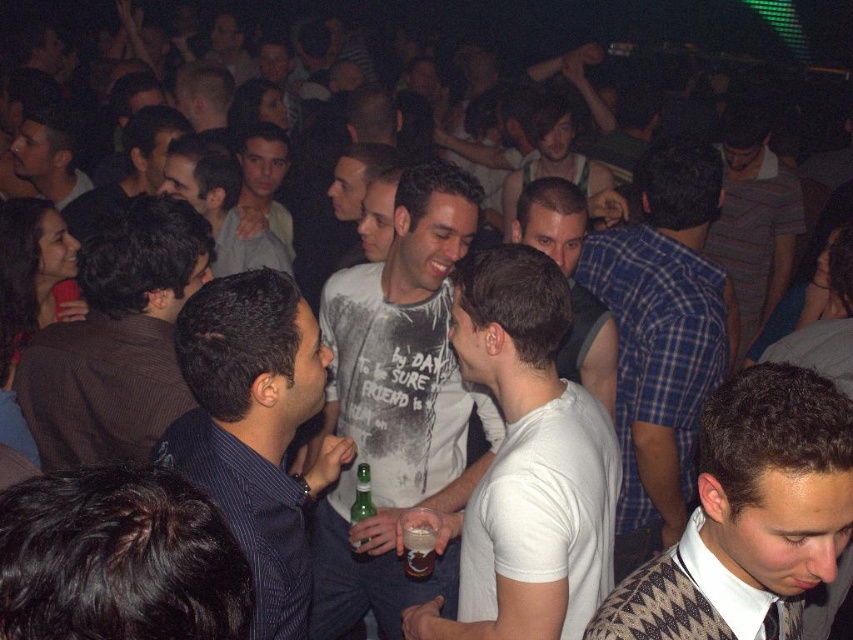
Consider the image. You are a bouncer at the nightclub and need to guide a guest to the VIP section located to the right of the blue striped shirt at center. Since the guest is currently near the matte black shirt at upper left, which direction should they move relative to their current position?

The guest should move to the right relative to their current position near the matte black shirt at upper left because the blue striped shirt at center is to the right of it, and the VIP section is located to the right of the blue striped shirt at center.

You are a photographer at the nightclub trying to capture a wide shot of the crowd. You notice the blue striped shirt at center and the matte black shirt at upper left. Which of these two shirts is narrower in width when viewed from your current position?

The blue striped shirt at center has a lesser width compared to matte black shirt at upper left, so the blue striped shirt at center is narrower in width.